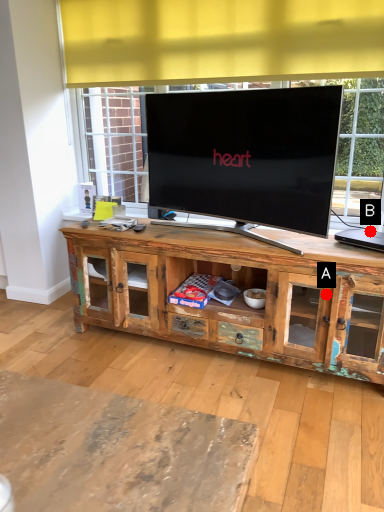
Question: Two points are circled on the image, labeled by A and B beside each circle. Which point is closer to the camera?

Choices:
 (A) A is closer
 (B) B is closer

Answer: (A)